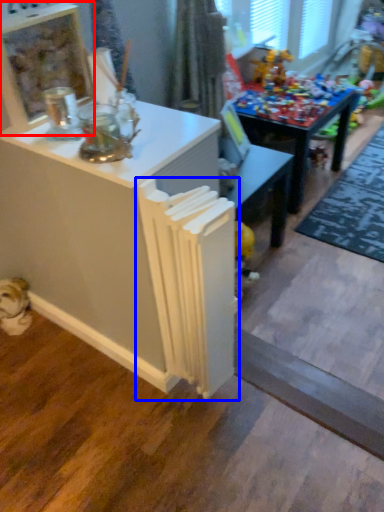
Question: Among these objects, which one is nearest to the camera, shelf (highlighted by a red box) or radiator (highlighted by a blue box)?

Choices:
 (A) shelf
 (B) radiator

Answer: (B)